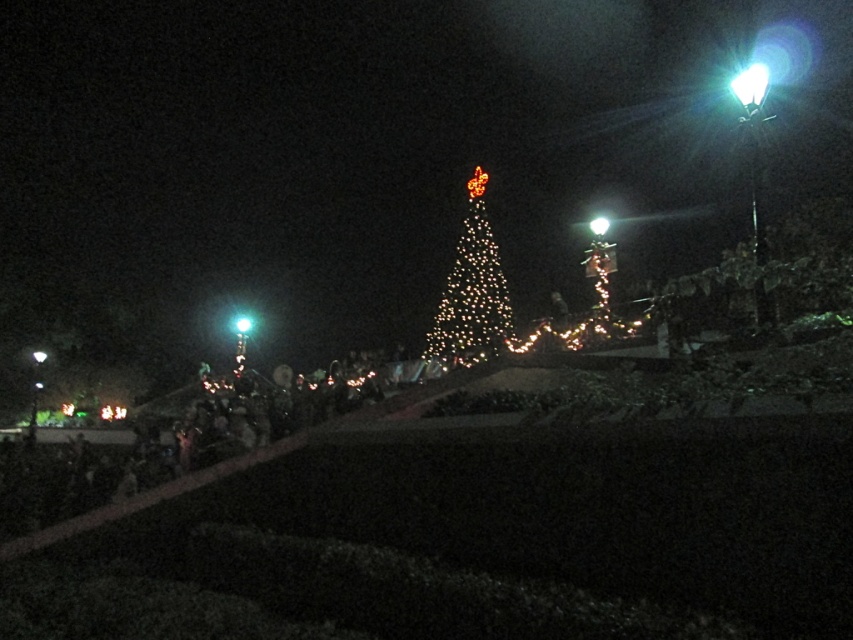
Can you confirm if illuminated plastic christmas tree at center is positioned below white glass light at upper right?

Correct, illuminated plastic christmas tree at center is located below white glass light at upper right.

Is illuminated plastic christmas tree at center thinner than white glass light at upper right?

Incorrect, illuminated plastic christmas tree at center's width is not less than white glass light at upper right's.

Which is in front, point (474, 180) or point (596, 234)?

Point (596, 234) is in front.

Image resolution: width=853 pixels, height=640 pixels. In order to click on illuminated plastic christmas tree at center in this screenshot , I will do `click(473, 292)`.

Is illuminated plastic christmas tree at center behind green glass light at center?

That is False.

Between point (508, 308) and point (251, 326), which one is positioned in front?

Point (508, 308)

Where is `illuminated plastic christmas tree at center`? illuminated plastic christmas tree at center is located at coordinates (473, 292).

Is point (426, 333) more distant than point (734, 90)?

Yes, it is.

Who is higher up, illuminated plastic christmas tree at center or white plastic light at upper right?

white plastic light at upper right is above.

Between point (466, 273) and point (746, 106), which one is positioned behind?

Point (466, 273)

The image size is (853, 640). I want to click on illuminated plastic christmas tree at center, so click(473, 292).